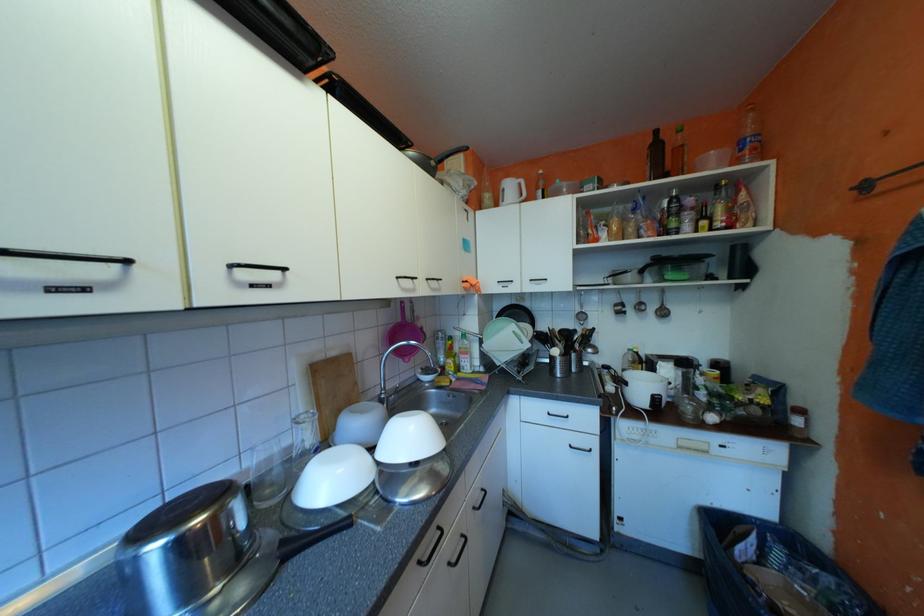
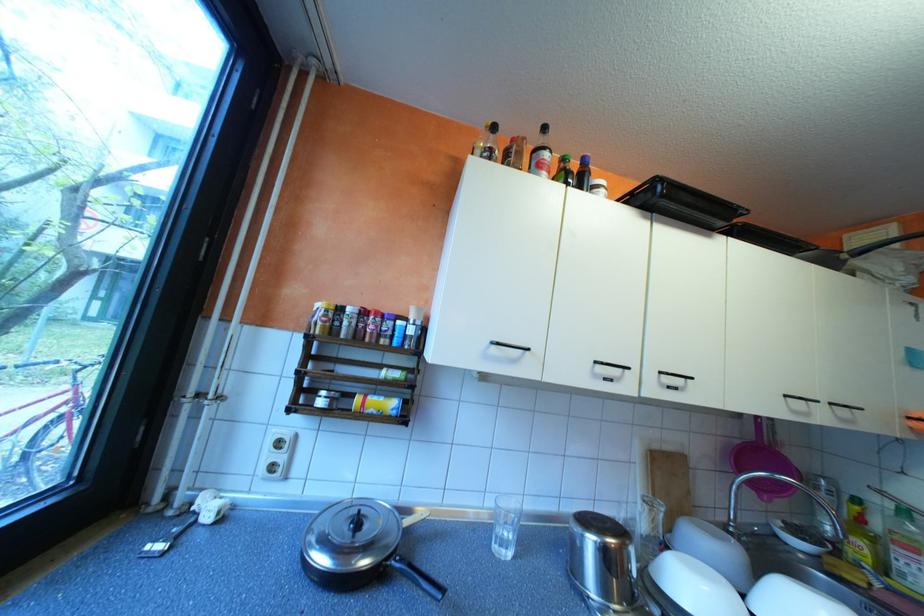
Locate, in the second image, the point that corresponds to point 248,282 in the first image.

(673, 383)